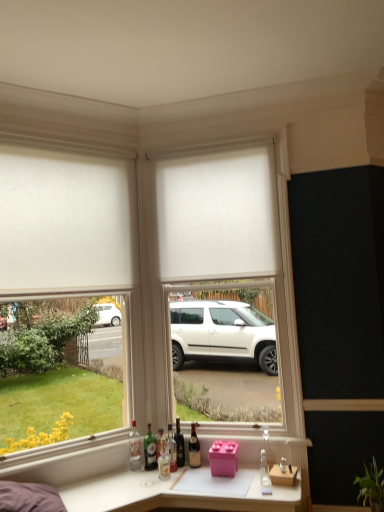
I want to click on vacant space behind clear glass bottle at center, which is counted as the first bottle, starting from the right, so click(254, 473).